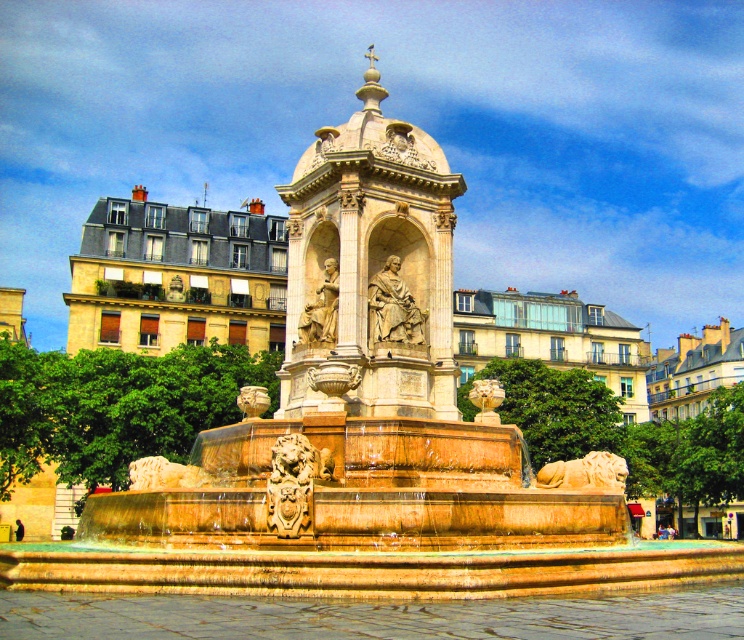
Question: Is carved stone lion at center to the right of golden stone statue at center from the viewer's perspective?

Choices:
 (A) yes
 (B) no

Answer: (B)

Question: Is stone statue at center below gold polished lion at center?

Choices:
 (A) no
 (B) yes

Answer: (A)

Question: Among these points, which one is farthest from the camera?

Choices:
 (A) (304, 483)
 (B) (484, 416)
 (C) (574, 477)

Answer: (B)

Question: Which point appears closest to the camera in this image?

Choices:
 (A) (475, 388)
 (B) (571, 476)
 (C) (275, 516)

Answer: (C)

Question: Does carved stone lion at center have a lesser width compared to golden stone statue at center?

Choices:
 (A) no
 (B) yes

Answer: (B)

Question: Which of these objects is positioned farthest from the golden stone statue at center?

Choices:
 (A) carved stone lion at center
 (B) polished bronze statue at center
 (C) stone statue at center
 (D) golden stone lion at lower center

Answer: (C)